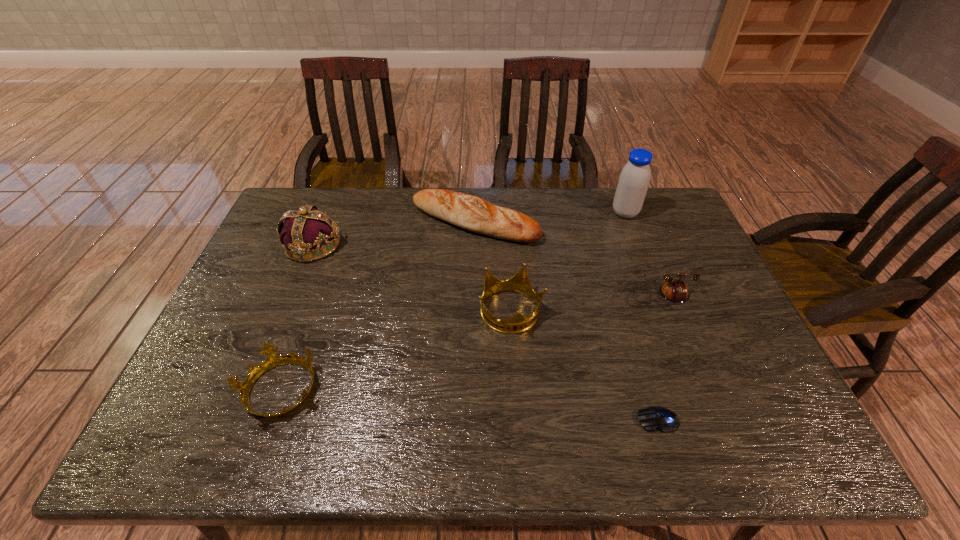
What are the coordinates of `vacant area between the computer mouse and the tallest object` in the screenshot? It's located at (641, 316).

Image resolution: width=960 pixels, height=540 pixels. I want to click on free spot between the telephone and the baguet, so click(x=567, y=259).

Identify the location of free area in between the shortest crown and the farthest crown. The width and height of the screenshot is (960, 540). (297, 318).

I want to click on the third closest object to the telephone, so (654, 417).

Where is `object identified as the fourth closest to the nearest crown`? object identified as the fourth closest to the nearest crown is located at coordinates (654, 417).

Image resolution: width=960 pixels, height=540 pixels. Identify the location of the closest crown to the tallest crown. (273, 360).

Point out which crown is positioned as the third nearest to the soya milk. Please provide its 2D coordinates. Your answer should be formatted as a tuple, i.e. [(x, y)], where the tuple contains the x and y coordinates of a point satisfying the conditions above.

[(273, 360)]

Find the location of a particular element. Image resolution: width=960 pixels, height=540 pixels. vacant space that satisfies the following two spatial constraints: 1. on the rotary dial of the telephone; 2. on the button side of the computer mouse is located at coordinates (708, 420).

What are the coordinates of `vacant region that satisfies the following two spatial constraints: 1. on the front side of the second nearest crown; 2. on the right side of the tallest crown` in the screenshot? It's located at (286, 312).

Where is `free space that satisfies the following two spatial constraints: 1. on the front side of the second tallest object; 2. on the left side of the shortest crown`? free space that satisfies the following two spatial constraints: 1. on the front side of the second tallest object; 2. on the left side of the shortest crown is located at coordinates (253, 391).